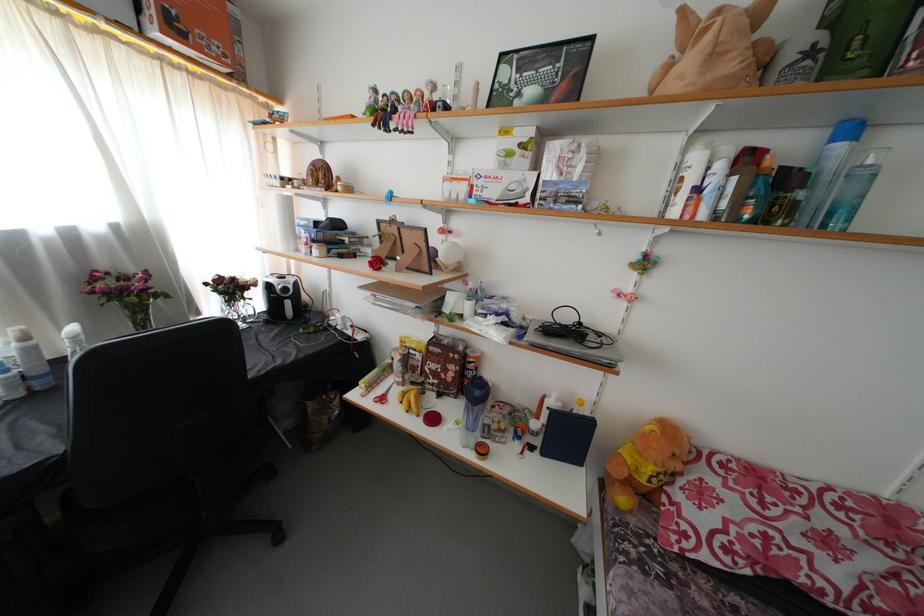
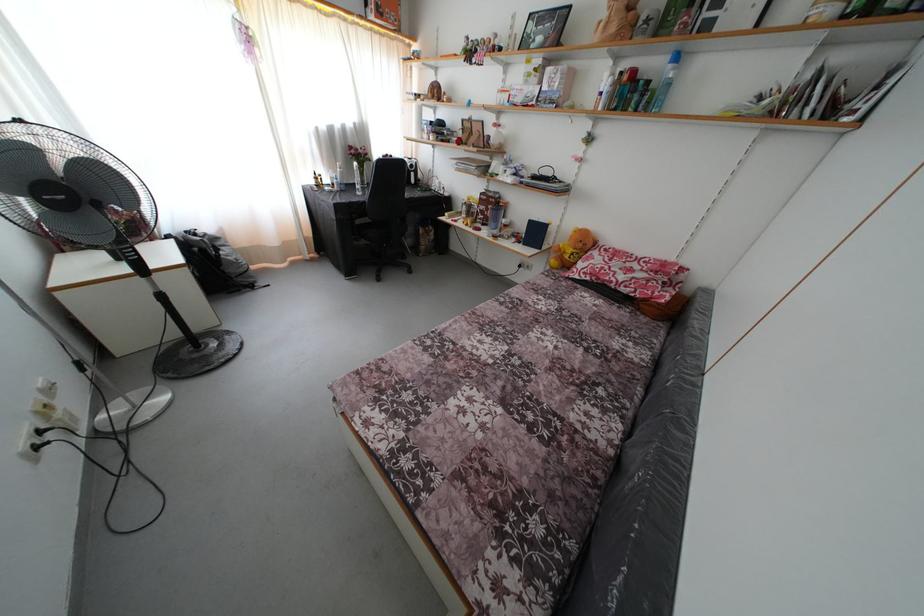
Find the pixel in the second image that matches (845,153) in the first image.

(675, 73)